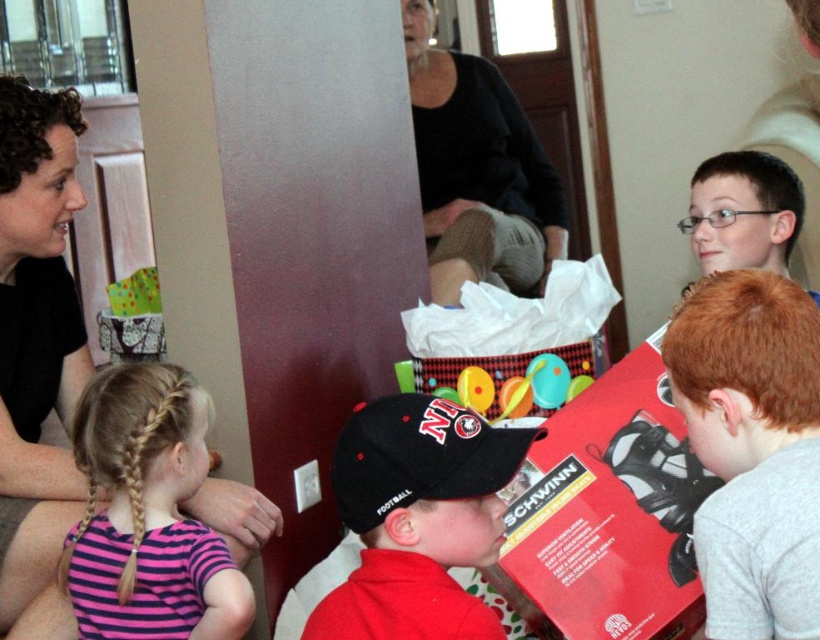
You are a fashion designer observing the scene. You need to determine which clothing item is shorter between the matte black shirt at left and the black cotton sweater at upper center. Which one is shorter?

The matte black shirt at left is shorter than the black cotton sweater at upper center.